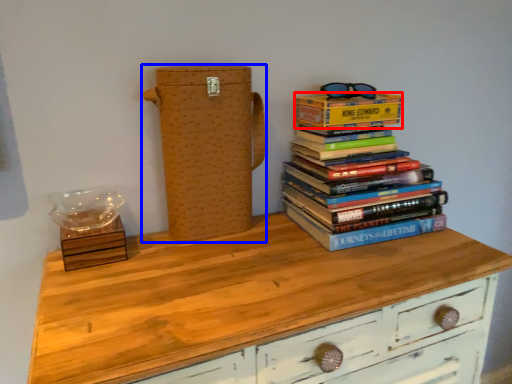
Question: Which of the following is the closest to the observer, paperback book (highlighted by a red box) or cardboard box (highlighted by a blue box)?

Choices:
 (A) paperback book
 (B) cardboard box

Answer: (B)